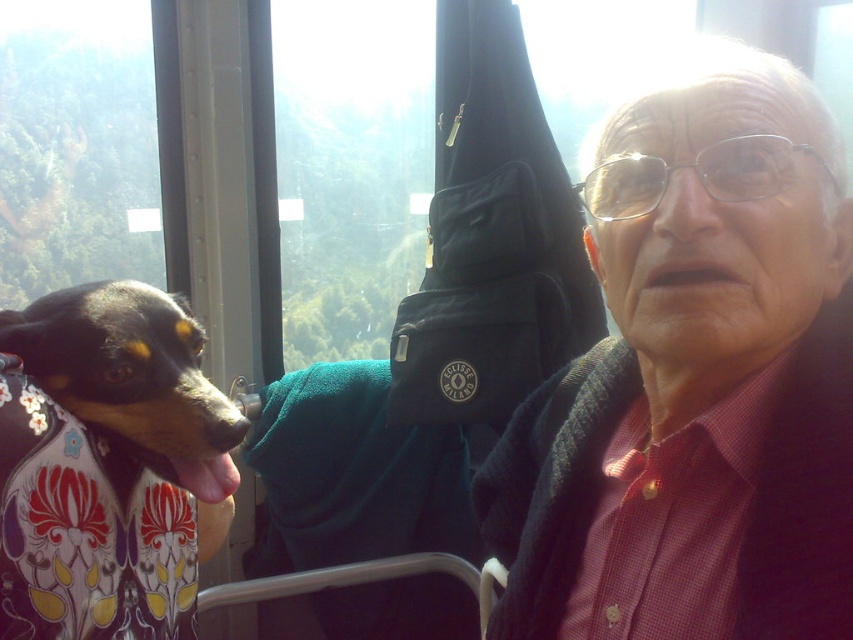
Question: Does matte black jacket at center have a lesser width compared to smooth black and tan dog at left?

Choices:
 (A) yes
 (B) no

Answer: (B)

Question: Is matte black jacket at center below smooth black and tan dog at left?

Choices:
 (A) no
 (B) yes

Answer: (B)

Question: Which point is farther to the camera?

Choices:
 (A) (231, 419)
 (B) (781, 81)

Answer: (A)

Question: Which of the following is the closest to the observer?

Choices:
 (A) smooth black and tan dog at left
 (B) matte black jacket at center

Answer: (B)

Question: Can you confirm if matte black jacket at center is positioned below smooth black and tan dog at left?

Choices:
 (A) yes
 (B) no

Answer: (A)